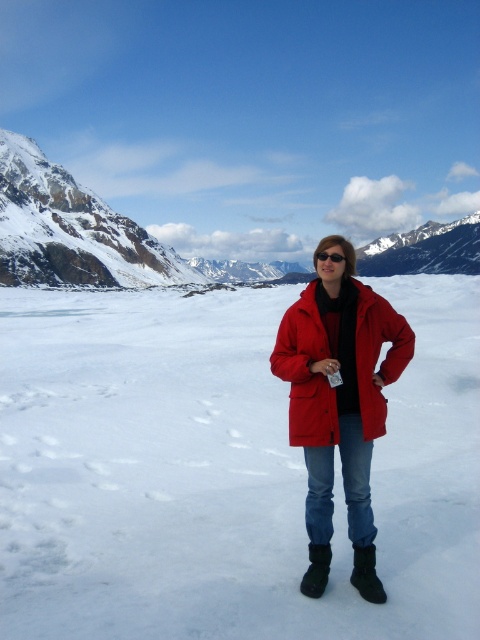
You are a photographer aiming to capture the snow at the center of the scene. Since you are holding a camera, can you focus on the white matte snow at center without the matte red jacket at center blocking the view?

The white matte snow at center is in front of the matte red jacket at center, so the snow would block the view of the jacket. Therefore, you cannot focus on the snow at center without the jacket being in front.

You are planning to take a photo of the person wearing the matte red jacket at center. Since the white matte snow at center is part of the background, will the snow cover more of the frame horizontally compared to the jacket?

The white matte snow at center might be wider than the matte red jacket at center, so it could cover more of the frame horizontally.

You are a photographer trying to capture the perfect shot of the mountain landscape. You have two points marked on your camera screen at coordinates point [399,332] and point [324,252]. Which point is closer to you, the photographer?

Point [399,332] is in front of point [324,252], so it is closer to you as the photographer.